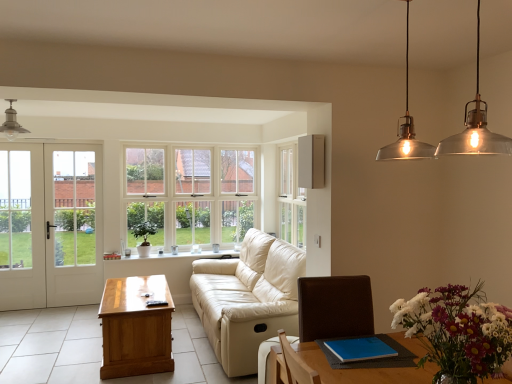
Describe the element at coordinates (22, 227) in the screenshot. I see `white glass door at left` at that location.

Image resolution: width=512 pixels, height=384 pixels. What do you see at coordinates (190, 195) in the screenshot?
I see `white glass window at center` at bounding box center [190, 195].

What is the approximate height of light brown wooden table at left?

light brown wooden table at left is 53.96 centimeters tall.

Identify the location of white wooden door at left. (50, 225).

In order to click on light beige leather armchair at lower center in this screenshot , I will do `click(265, 357)`.

In order to face wooden coffee table at center, should I rotate leftwards or rightwards?

To align with it, rotate left about 19.622°.

Where is `white glass door at left`? white glass door at left is located at coordinates (22, 227).

You are a GUI agent. You are given a task and a screenshot of the screen. Output one action in this format:
    pyautogui.click(x=<x>, y=<y>)
    Task: Click on the door located behind the wooden coffee table at center
    
    Given the screenshot: What is the action you would take?
    pyautogui.click(x=50, y=225)

In the scene shown: From the image's perspective, relative to white wooden door at left, is wooden coffee table at center above or below?

wooden coffee table at center is situated lower than white wooden door at left in the image.

How much distance is there between wooden coffee table at center and white wooden door at left?

wooden coffee table at center and white wooden door at left are 1.34 meters apart from each other.

Do you think wooden coffee table at center is within multicolored floral bouquet at lower right, or outside of it?

wooden coffee table at center is spatially situated outside multicolored floral bouquet at lower right.

Is wooden coffee table at center facing towards multicolored floral bouquet at lower right?

No, wooden coffee table at center is not facing towards multicolored floral bouquet at lower right.

Can you confirm if wooden coffee table at center is smaller than multicolored floral bouquet at lower right?

Actually, wooden coffee table at center might be larger than multicolored floral bouquet at lower right.

Considering the relative positions of light brown wooden table at left and white glossy window sill at center in the image provided, is light brown wooden table at left behind white glossy window sill at center?

No, light brown wooden table at left is in front of white glossy window sill at center.

Does light brown wooden table at left have a smaller size compared to white glossy window sill at center?

No.

The width and height of the screenshot is (512, 384). Find the location of `table that appears on the left of white glossy window sill at center`. table that appears on the left of white glossy window sill at center is located at coordinates (136, 327).

Does point (143, 354) appear closer or farther from the camera than point (212, 257)?

Point (143, 354) is closer to the camera than point (212, 257).

Which is behind, white wooden door at left or white glass door at left?

white glass door at left.

Which object is positioned more to the left, white wooden door at left or white glass door at left?

white glass door at left is more to the left.

Considering the sizes of objects white wooden door at left and white glass door at left in the image provided, who is shorter, white wooden door at left or white glass door at left?

Standing shorter between the two is white glass door at left.

From the image's perspective, is white wooden door at left above or below white glass door at left?

From the image's perspective, white wooden door at left appears above white glass door at left.

Where is `studio couch in front of the light brown wooden table at left`? studio couch in front of the light brown wooden table at left is located at coordinates (248, 298).

Could light brown wooden table at left be considered to be inside beige leather couch at center?

No, beige leather couch at center does not contain light brown wooden table at left.

From a real-world perspective, who is located lower, beige leather couch at center or light brown wooden table at left?

light brown wooden table at left.

Consider the image. Measure the distance from beige leather couch at center to light brown wooden table at left.

They are 28.80 inches apart.

Is white glass door at left oriented towards white glass window at center?

No, white glass door at left is not turned towards white glass window at center.

Consider the image. How distant is white glass door at left from white glass window at center?

white glass door at left is 1.64 meters away from white glass window at center.

Is white glass door at left not within white glass window at center?

Yes, white glass door at left is outside of white glass window at center.

Is white glass door at left smaller than white glass window at center?

Yes, white glass door at left is smaller than white glass window at center.

Does point (7, 218) come farther from viewer compared to point (132, 256)?

No, it is in front of (132, 256).

Are white wooden door at left and white glossy window sill at center beside each other?

white wooden door at left is not next to white glossy window sill at center, and they're not touching.

From the picture: Does white wooden door at left contain white glossy window sill at center?

Actually, white glossy window sill at center is outside white wooden door at left.

Considering the relative positions of white wooden door at left and white glossy window sill at center in the image provided, is white wooden door at left in front of white glossy window sill at center?

Yes.

Locate an element on the screen. The height and width of the screenshot is (384, 512). door lying above the wooden coffee table at center (from the image's perspective) is located at coordinates (50, 225).

The image size is (512, 384). Find the location of `floral arrangement above the wooden coffee table at center (from a real-world perspective)`. floral arrangement above the wooden coffee table at center (from a real-world perspective) is located at coordinates (458, 331).

Estimate the real-world distances between objects in this image. Which object is closer to light beige leather armchair at lower center, wooden coffee table at center or light brown wooden table at left?

light brown wooden table at left lies closer to light beige leather armchair at lower center than the other object.

Looking at the image, which one is located further to white glass window at center, white glass door at left or white glossy window sill at center?

The object further to white glass window at center is white glass door at left.

Considering their positions, is white wooden door at left positioned further to matte silver light fixture at upper left than white glass door at left?

white wooden door at left is positioned further to the anchor matte silver light fixture at upper left.

Which object lies nearer to the anchor point white glass window at center, light brown wooden table at left or white glass door at left?

white glass door at left is positioned closer to the anchor white glass window at center.

Looking at the image, which one is located further to white glass window at center, matte silver light fixture at upper left or wooden coffee table at center?

matte silver light fixture at upper left is further to white glass window at center.

Considering their positions, is light beige leather armchair at lower center positioned closer to light brown wooden table at left than beige leather couch at center?

beige leather couch at center is positioned closer to the anchor light brown wooden table at left.

Considering their positions, is wooden coffee table at center positioned further to multicolored floral bouquet at lower right than white glass door at left?

white glass door at left is positioned further to the anchor multicolored floral bouquet at lower right.

Which object lies further to the anchor point white glass door at left, light beige leather armchair at lower center or white wooden door at left?

light beige leather armchair at lower center is further to white glass door at left.

Locate an element on the screen. The height and width of the screenshot is (384, 512). tile located between white glass door at left and light beige leather armchair at lower center in the left-right direction is located at coordinates (90, 348).

Locate an element on the screen. This screenshot has height=384, width=512. light fixture between wooden coffee table at center and white glossy window sill at center from front to back is located at coordinates (11, 123).

This screenshot has height=384, width=512. Find the location of `door between light beige leather armchair at lower center and white glass window at center from front to back`. door between light beige leather armchair at lower center and white glass window at center from front to back is located at coordinates (50, 225).

The image size is (512, 384). I want to click on table between white wooden door at left and light beige leather armchair at lower center in the horizontal direction, so click(136, 327).